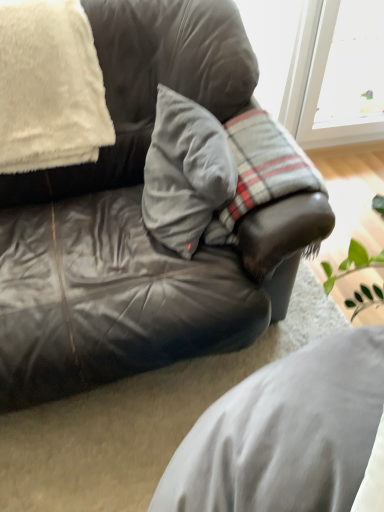
Question: Considering their positions, is white fluffy blanket at upper left, positioned as the 2th pillow in right-to-left order, located in front of or behind leather cushion at center?

Choices:
 (A) behind
 (B) front

Answer: (A)

Question: In terms of height, does white fluffy blanket at upper left, which ranks as the first pillow in left-to-right order, look taller or shorter compared to leather cushion at center?

Choices:
 (A) tall
 (B) short

Answer: (B)

Question: Which object is the farthest from the white fluffy blanket at upper left, positioned as the 2th pillow in right-to-left order?

Choices:
 (A) matte gray leather couch at center
 (B) gray cotton pillow at center, positioned as the 1th pillow in right-to-left order
 (C) leather cushion at center

Answer: (C)

Question: Which is farther from the leather cushion at center?

Choices:
 (A) gray cotton pillow at center, the 2th pillow when ordered from left to right
 (B) matte gray leather couch at center
 (C) white fluffy blanket at upper left, which ranks as the first pillow in left-to-right order

Answer: (C)